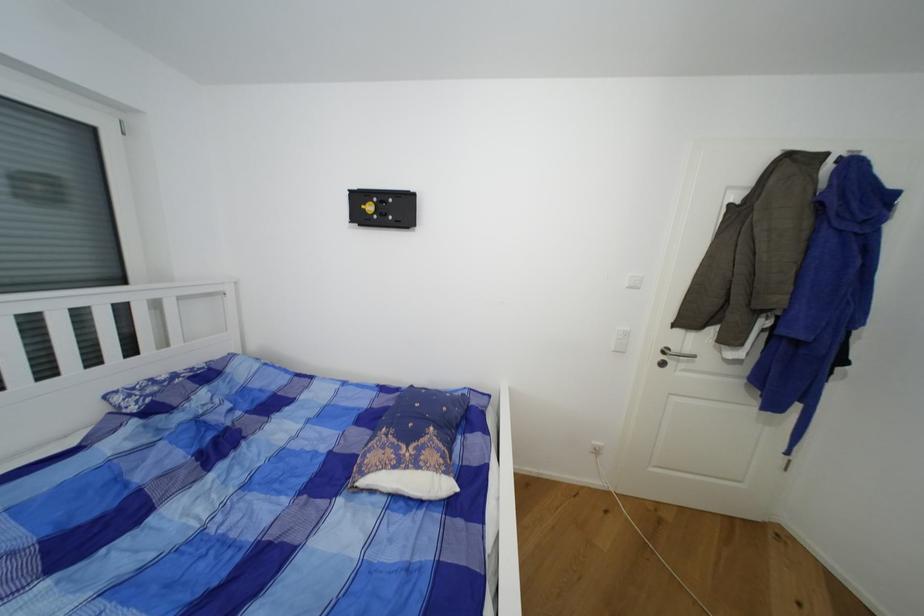
This screenshot has width=924, height=616. Identify the location of yellow adjustment knob. (369, 207).